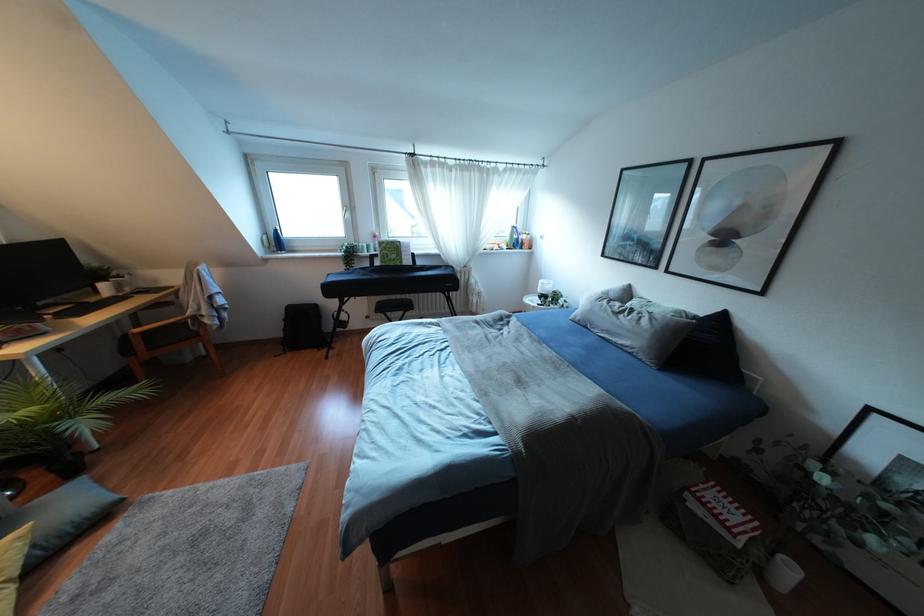
Where is `green music book`? green music book is located at coordinates (394, 252).